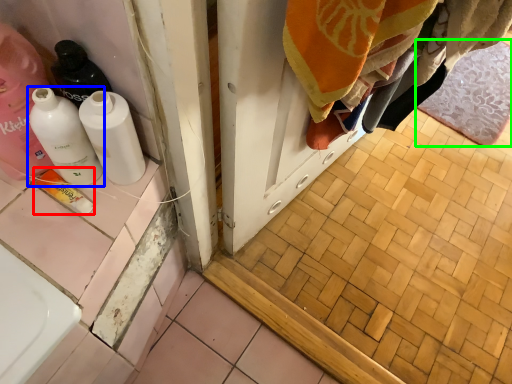
Question: Considering the real-world distances, which object is closest to product (highlighted by a red box)? bottle (highlighted by a blue box) or bath mat (highlighted by a green box).

Choices:
 (A) bottle
 (B) bath mat

Answer: (A)